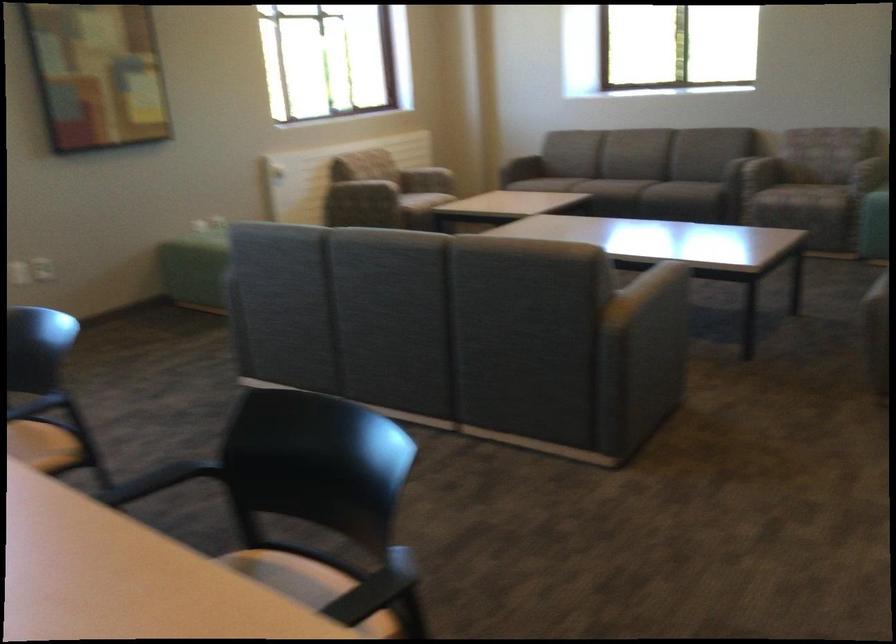
This screenshot has height=644, width=896. Find the location of `sofa sitting surface`. sofa sitting surface is located at coordinates (807, 184).